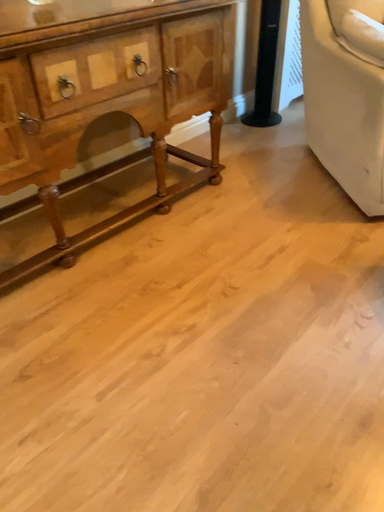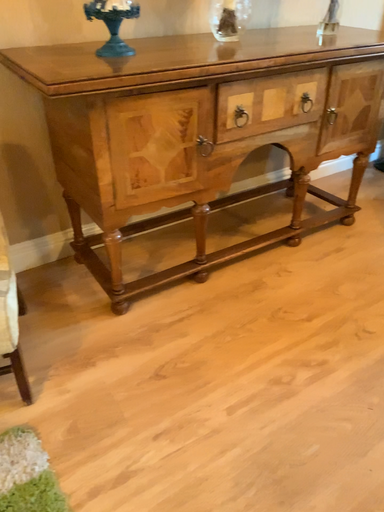
Question: Which way did the camera rotate in the video?

Choices:
 (A) rotated left
 (B) rotated right

Answer: (A)